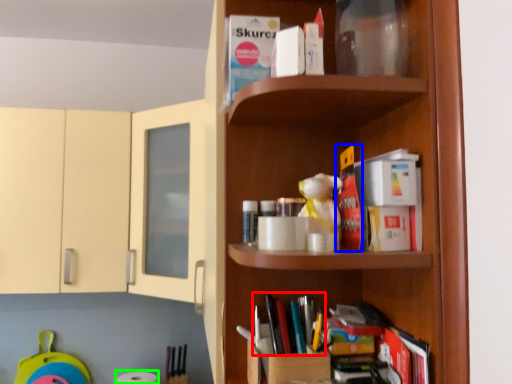
Question: Which is farther away from book (highlighted by a red box)? book (highlighted by a blue box) or toilet paper (highlighted by a green box)?

Choices:
 (A) book
 (B) toilet paper

Answer: (B)